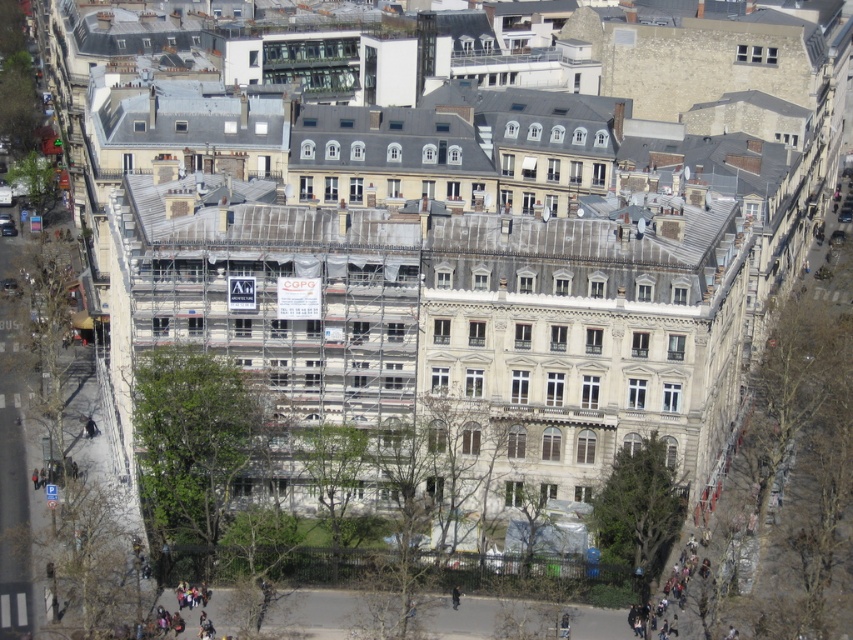
Can you confirm if dark gray concrete stairs at lower right is positioned below dark gray jacket at center?

Incorrect, dark gray concrete stairs at lower right is not positioned below dark gray jacket at center.

Is point (674, 595) positioned after point (456, 605)?

Yes.

Where is `dark gray concrete stairs at lower right`? dark gray concrete stairs at lower right is located at coordinates (666, 588).